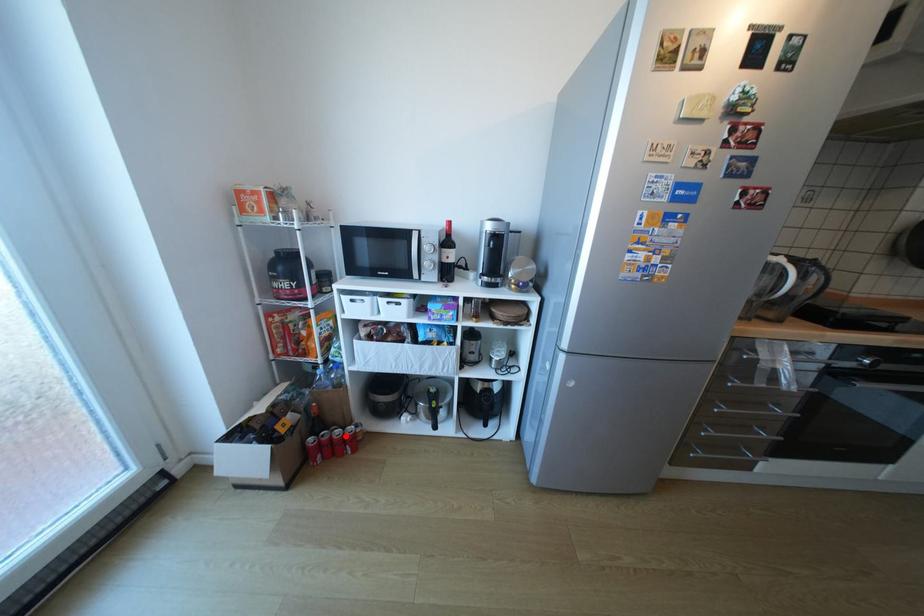
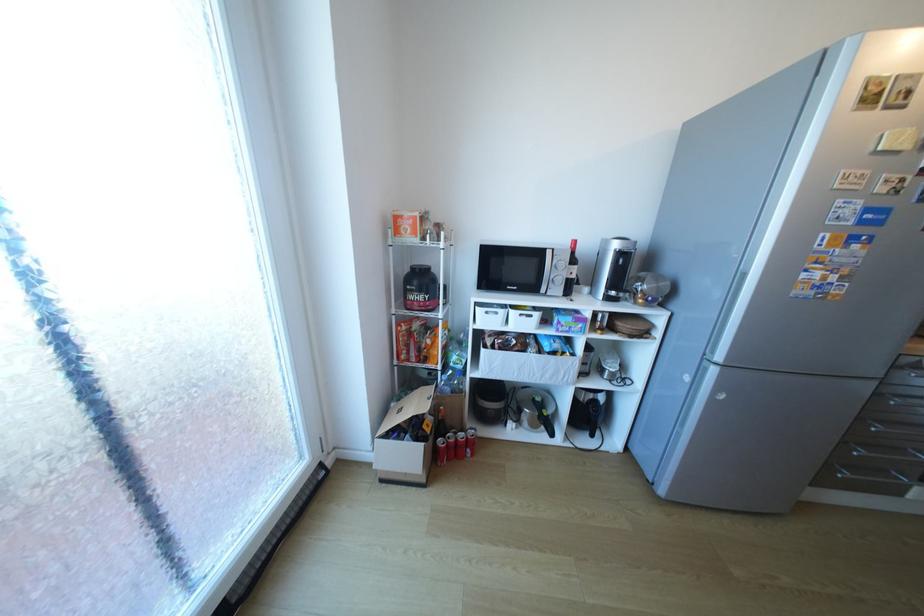
The point at the highlighted location is marked in the first image. Where is the corresponding point in the second image?

(469, 439)